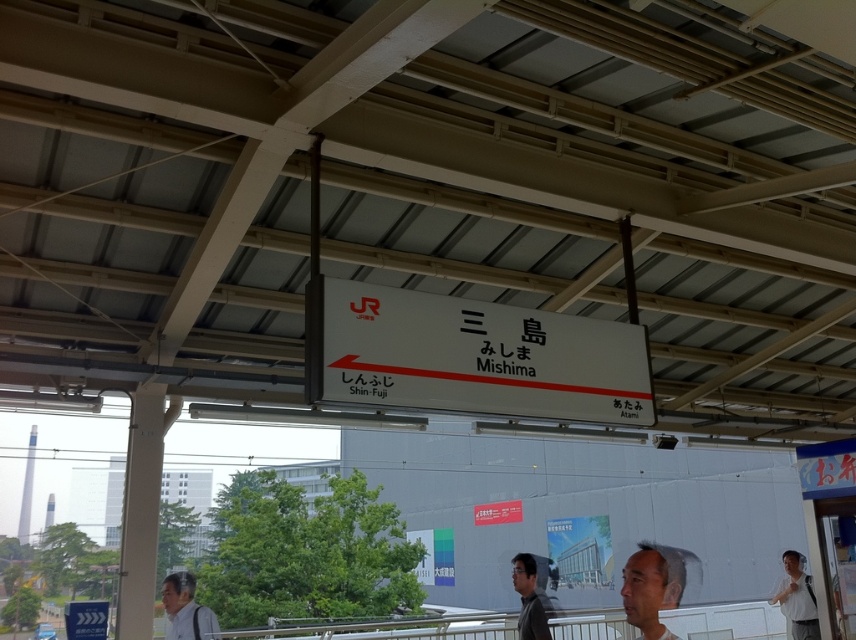
Question: Observing the image, what is the correct spatial positioning of light gray shirt at lower left in reference to matte gray shirt at lower center?

Choices:
 (A) above
 (B) below

Answer: (A)

Question: Does white shirt at lower right have a greater width compared to matte gray shirt at lower center?

Choices:
 (A) yes
 (B) no

Answer: (B)

Question: Considering the real-world distances, which object is closest to the light gray shirt at lower left?

Choices:
 (A) white plastic sign at center
 (B) matte gray shirt at lower center
 (C) smooth skin face at lower center

Answer: (A)

Question: Which of the following is the farthest from the observer?

Choices:
 (A) smooth skin face at lower center
 (B) white plastic sign at center

Answer: (B)

Question: Among these objects, which one is farthest from the camera?

Choices:
 (A) white plastic sign at center
 (B) matte gray shirt at lower center
 (C) smooth skin face at lower center

Answer: (B)

Question: Does light gray shirt at lower left have a greater width compared to white shirt at lower right?

Choices:
 (A) no
 (B) yes

Answer: (B)